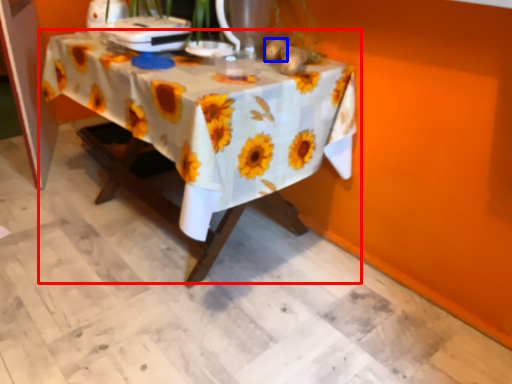
Question: Which of the following is the closest to the observer, table (highlighted by a red box) or flower (highlighted by a blue box)?

Choices:
 (A) table
 (B) flower

Answer: (A)